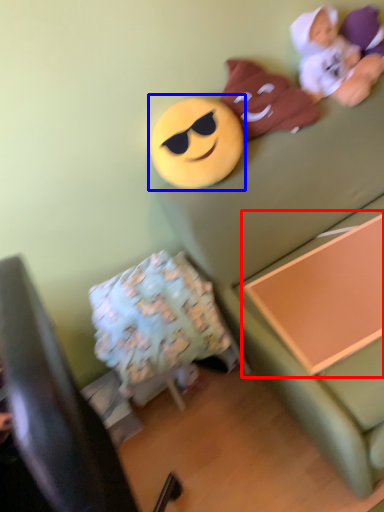
Question: Which object appears closest to the camera in this image, changing table (highlighted by a red box) or toy (highlighted by a blue box)?

Choices:
 (A) changing table
 (B) toy

Answer: (A)